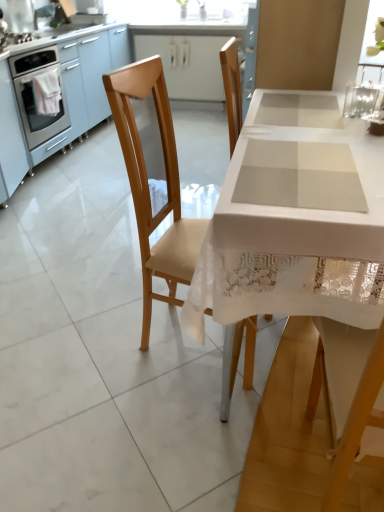
Identify the location of vacant space to the left of white lace table at center. (83, 327).